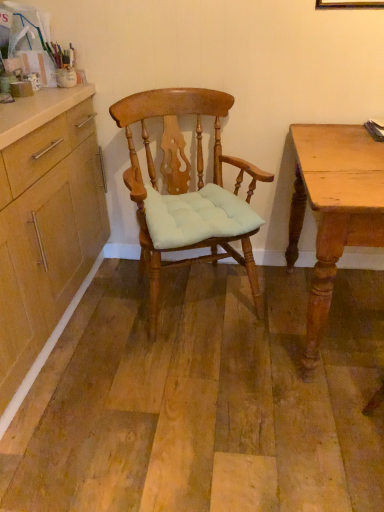
Question: Is light brown wooden desk at right looking in the opposite direction of matte wood chair at center?

Choices:
 (A) no
 (B) yes

Answer: (A)

Question: Is light brown wooden desk at right facing towards matte wood chair at center?

Choices:
 (A) yes
 (B) no

Answer: (B)

Question: Would you say light brown wooden desk at right is outside matte wood chair at center?

Choices:
 (A) no
 (B) yes

Answer: (B)

Question: Is light brown wooden desk at right thinner than matte wood chair at center?

Choices:
 (A) no
 (B) yes

Answer: (A)

Question: From the image's perspective, is light brown wooden desk at right above matte wood chair at center?

Choices:
 (A) no
 (B) yes

Answer: (A)

Question: Does light brown wooden desk at right come behind matte wood chair at center?

Choices:
 (A) yes
 (B) no

Answer: (B)

Question: Can you confirm if matte wood chair at center is thinner than light brown wooden desk at right?

Choices:
 (A) yes
 (B) no

Answer: (A)

Question: Is matte wood chair at center wider than light brown wooden desk at right?

Choices:
 (A) no
 (B) yes

Answer: (A)

Question: Is matte wood chair at center to the right of light brown wooden desk at right from the viewer's perspective?

Choices:
 (A) no
 (B) yes

Answer: (A)

Question: Can you confirm if matte wood chair at center is smaller than light brown wooden desk at right?

Choices:
 (A) yes
 (B) no

Answer: (A)

Question: Considering the relative positions of matte wood chair at center and light brown wooden desk at right in the image provided, is matte wood chair at center behind light brown wooden desk at right?

Choices:
 (A) no
 (B) yes

Answer: (B)

Question: Is matte wood chair at center not near light brown wooden desk at right?

Choices:
 (A) yes
 (B) no

Answer: (B)

Question: Considering the relative positions of matte wood chair at center and light brown wooden desk at right in the image provided, is matte wood chair at center to the left or to the right of light brown wooden desk at right?

Choices:
 (A) right
 (B) left

Answer: (B)